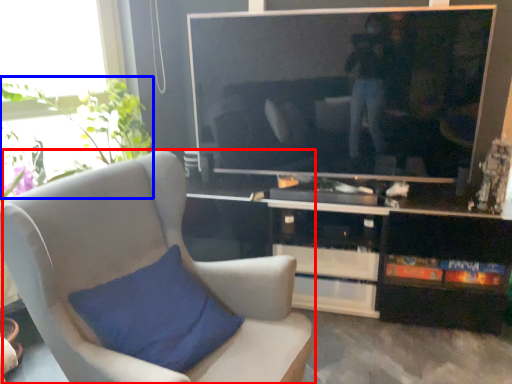
Question: Which object is closer to the camera taking this photo, chair (highlighted by a red box) or plant (highlighted by a blue box)?

Choices:
 (A) chair
 (B) plant

Answer: (A)